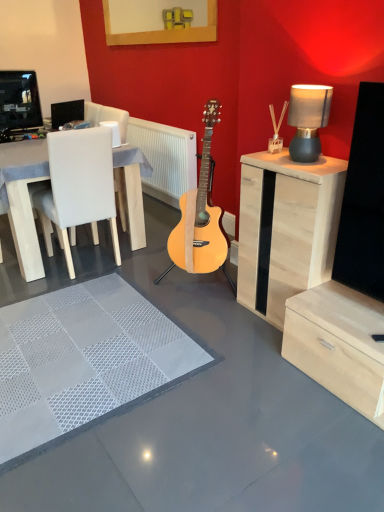
I want to click on free region under matte gray lampshade at upper right (from a real-world perspective), so click(x=309, y=158).